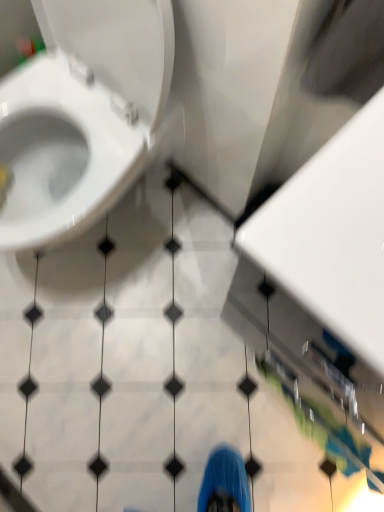
Image resolution: width=384 pixels, height=512 pixels. Find the location of `white glossy toilet at left`. white glossy toilet at left is located at coordinates pyautogui.click(x=82, y=115).

Measure the distance between point (x=88, y=28) and camera.

Point (x=88, y=28) is 32.68 inches away from camera.

The image size is (384, 512). What do you see at coordinates (82, 115) in the screenshot? I see `white glossy toilet at left` at bounding box center [82, 115].

The width and height of the screenshot is (384, 512). Identify the location of white glossy toilet at left. (82, 115).